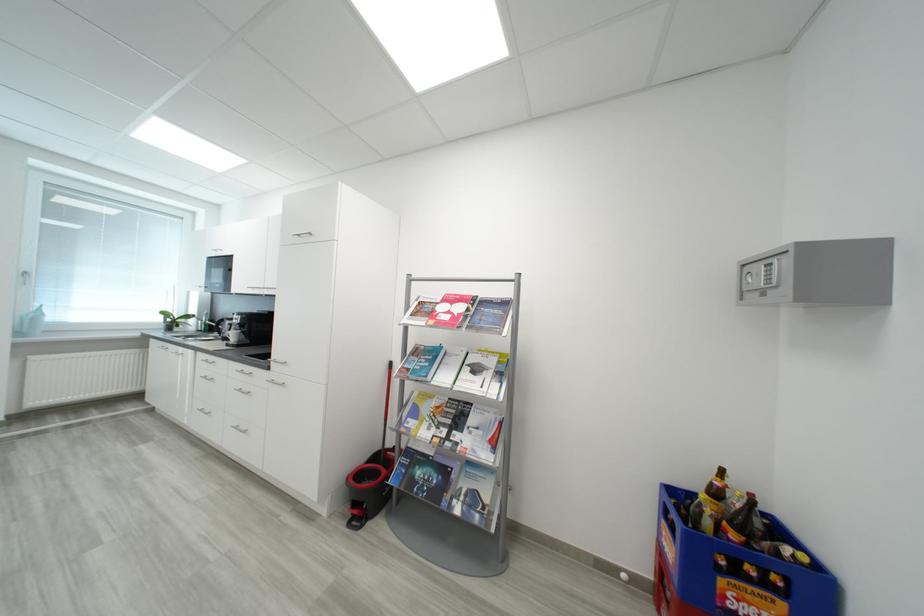
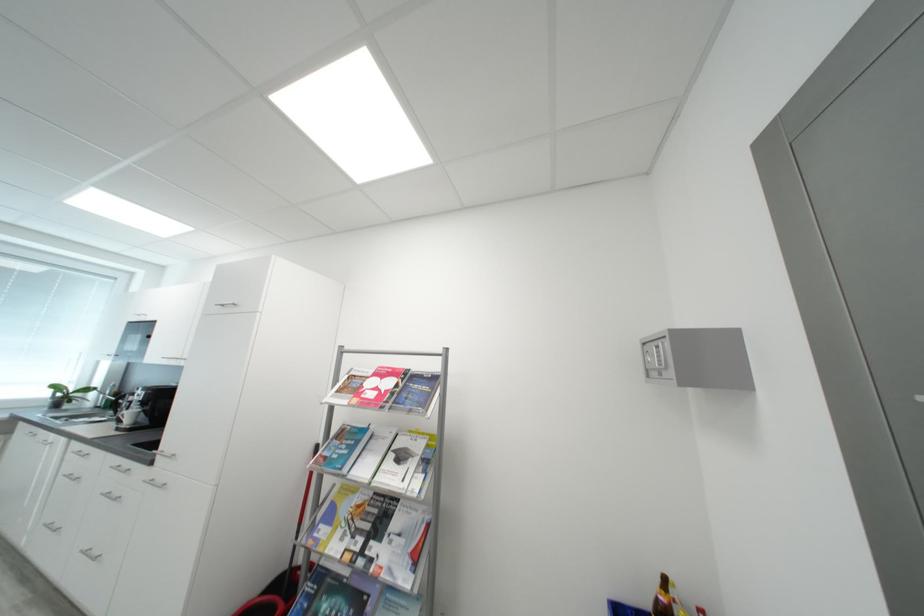
Locate, in the second image, the point that corresponds to point 171,315 in the first image.

(62, 389)